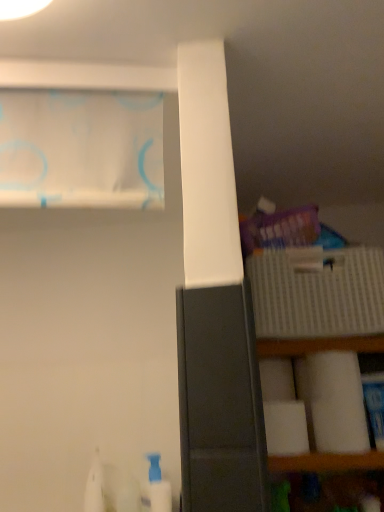
Question: Is white plastic bottle at lower left in front of or behind white sheer curtain at upper left in the image?

Choices:
 (A) behind
 (B) front

Answer: (A)

Question: In terms of width, does white plastic bottle at lower left look wider or thinner when compared to white sheer curtain at upper left?

Choices:
 (A) wide
 (B) thin

Answer: (A)

Question: Considering the real-world distances, which object is farthest from the white matte toilet paper at right, which is counted as the 2th toilet paper, starting from the back?

Choices:
 (A) white plastic bottle at lower left
 (B) white matte toilet paper at lower right, the first toilet paper from the back
 (C) white sheer curtain at upper left

Answer: (C)

Question: Based on their relative distances, which object is nearer to the white matte toilet paper at lower right, the first toilet paper from the back?

Choices:
 (A) white matte toilet paper at right, which is counted as the 2th toilet paper, starting from the back
 (B) white sheer curtain at upper left
 (C) white plastic bottle at lower left

Answer: (A)